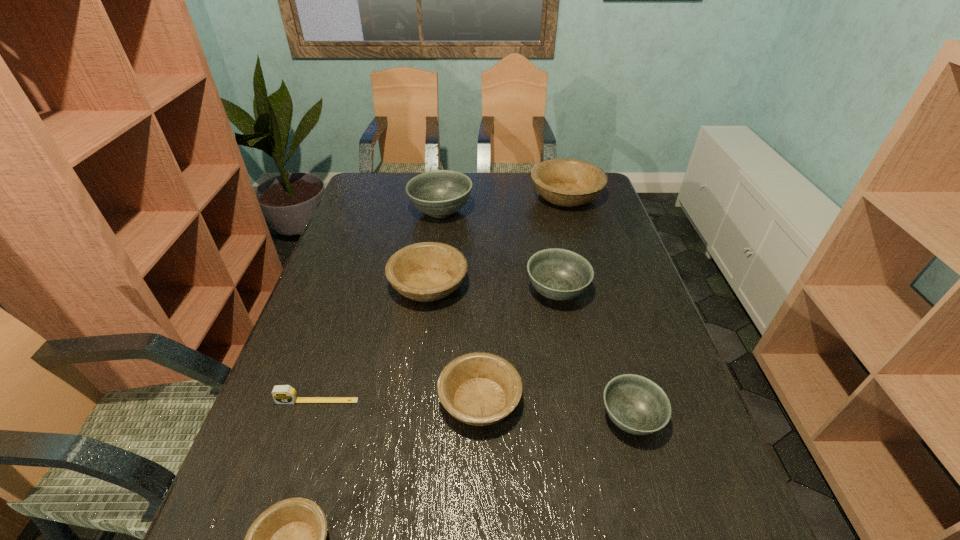
Identify the location of free location located 0.400m on the left of the rightmost beige bowl. (420, 197).

At what (x,y) coordinates should I click in order to perform the action: click on free space located on the back of the second smallest gray bowl. Please return your answer as a coordinate pair (x, y). This screenshot has height=540, width=960. Looking at the image, I should click on (543, 223).

I want to click on free space located 0.250m on the back of the third smallest beige bowl, so click(x=438, y=215).

This screenshot has width=960, height=540. What are the coordinates of `vacant point located 0.100m on the back of the nearest gray bowl` in the screenshot? It's located at (613, 356).

At what (x,y) coordinates should I click in order to perform the action: click on vacant space located 0.290m on the left of the second nearest beige bowl. Please return your answer as a coordinate pair (x, y). Looking at the image, I should click on (307, 401).

Locate an element on the screen. free space located 0.190m at the front of the tape measure with the tape extended is located at coordinates (288, 494).

Locate an element on the screen. object at the left edge is located at coordinates (282, 394).

This screenshot has height=540, width=960. I want to click on object present at the far right corner, so click(564, 182).

In the image, there is a desktop. At what (x,y) coordinates should I click in order to perform the action: click on vacant space at the far edge. Please return your answer as a coordinate pair (x, y). This screenshot has height=540, width=960. Looking at the image, I should click on (548, 205).

In order to click on vacant space at the left edge of the desktop in this screenshot , I will do `click(343, 275)`.